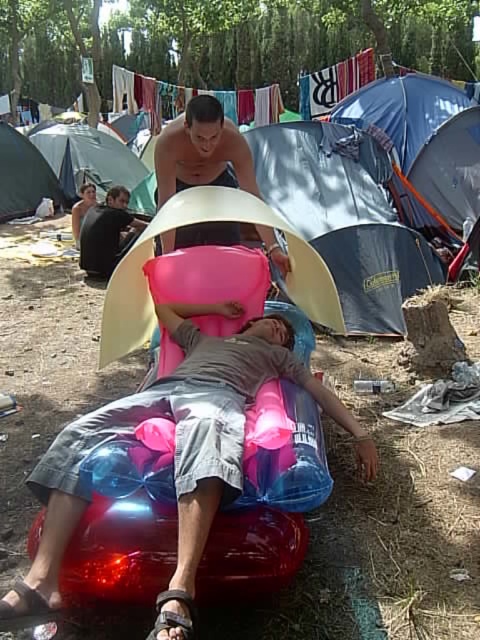
You are a hiker who wants to set up a tent in the camping area. You see the green fabric tent at left and the dark gray fabric shirt at center. Which object is higher up in the image?

The green fabric tent at left is located above the dark gray fabric shirt at center, so the green fabric tent at left is higher up in the image.

You are standing at the point with coordinates point (x=84, y=243) and want to walk to the point (x=49, y=193). According to the scene, will you be moving forward or backward?

Since point (x=49, y=193) is behind point (x=84, y=243), moving from point (x=84, y=243) to point (x=49, y=193) would require moving backward.

You are planning to set up a tent in the camping area. You see the green fabric tent at left and the dark gray fabric shirt at center. Which object is taller?

The green fabric tent at left is much taller than the dark gray fabric shirt at center.